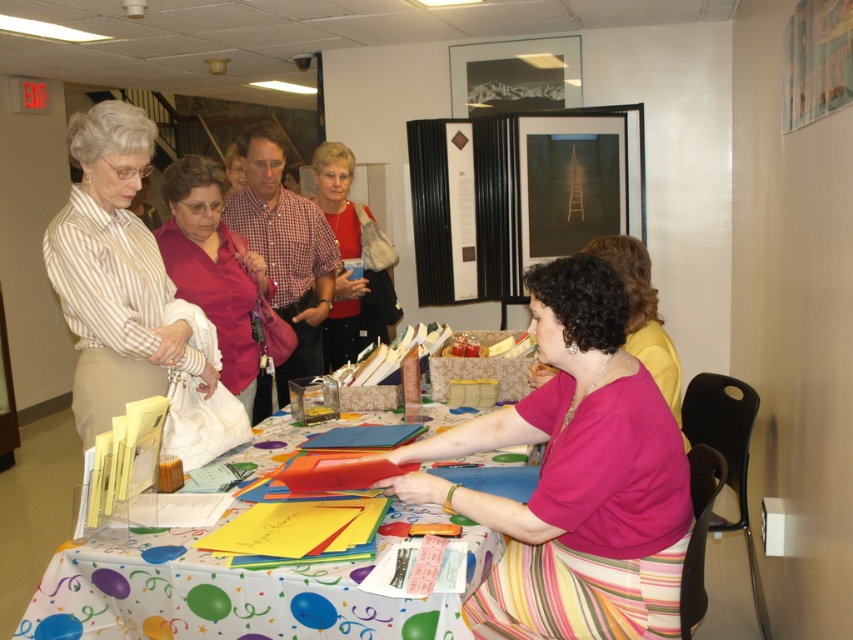
Question: Which object is positioned farthest from the pink matte shirt at center?

Choices:
 (A) matte pink blouse at center
 (B) matte red blouse at center
 (C) balloon-patterned paper at center

Answer: (B)

Question: Is pink fabric skirt at lower center above matte pink blouse at center?

Choices:
 (A) yes
 (B) no

Answer: (B)

Question: Which point is closer to the camera taking this photo?

Choices:
 (A) (633, 358)
 (B) (316, 362)

Answer: (A)

Question: Can you confirm if matte pink shirt at center is positioned to the right of matte pink blouse at center?

Choices:
 (A) yes
 (B) no

Answer: (A)

Question: Which point is closer to the camera?

Choices:
 (A) pink fabric skirt at lower center
 (B) matte red blouse at center
 (C) pink matte shirt at center
 (D) matte pink shirt at center

Answer: (A)

Question: Considering the relative positions of pink fabric skirt at lower center and striped fabric blouse at left in the image provided, where is pink fabric skirt at lower center located with respect to striped fabric blouse at left?

Choices:
 (A) right
 (B) left

Answer: (A)